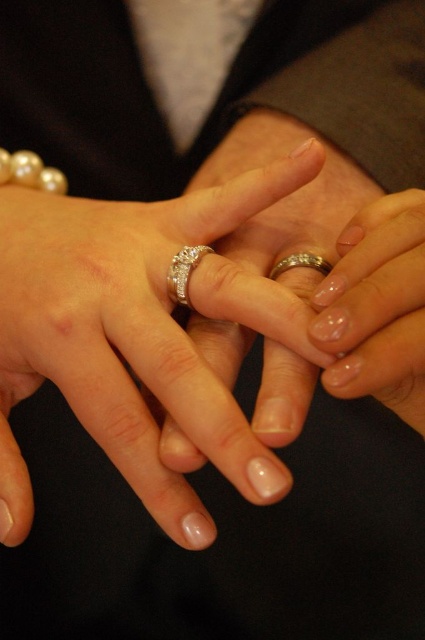
You are a photographer at a wedding ceremony. You need to capture a close shot of the rings being exchanged. The camera you are using has a minimum focus distance of 3 inches. Can you focus on both the matte silver ring at center and the diamond encrusted ring at center simultaneously?

The matte silver ring at center and diamond encrusted ring at center are 3.14 inches apart. Since the distance between them is greater than the camera minimum focus distance of 3 inches, the camera can focus on both rings simultaneously.

You are a photographer adjusting the camera settings to capture the diamond encrusted ring at center. Based on the coordinates provided, can you determine if the ring is positioned closer to the top or bottom of the frame?

The diamond encrusted ring at center is located at point 0.433 on the vertical axis. Since the coordinate system typically starts at the bottom left corner, a value of 0.433 indicates it is closer to the bottom of the frame.